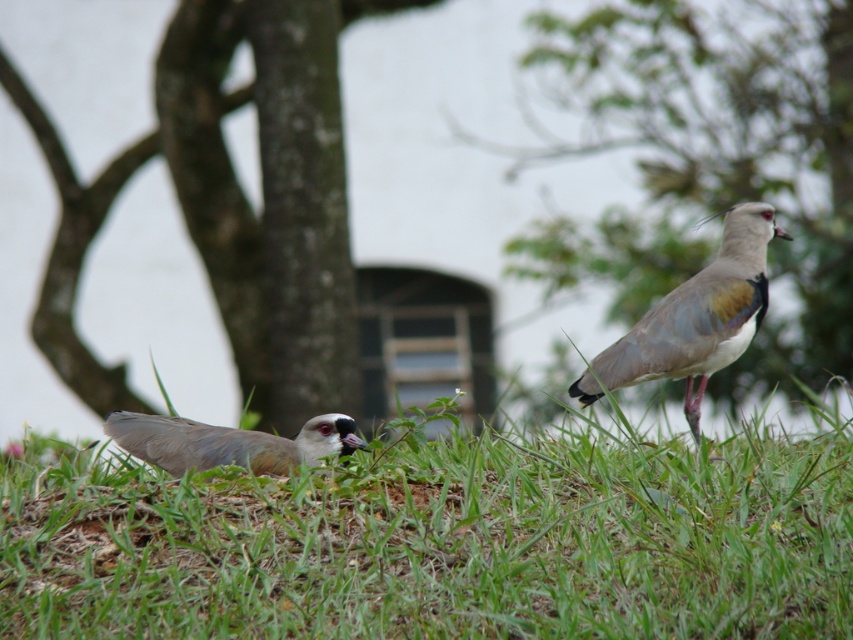
Question: Which point is closer to the camera taking this photo?

Choices:
 (A) (350, 422)
 (B) (643, 189)
 (C) (726, 520)

Answer: (C)

Question: Is green textured tree at center in front of green leafy tree at center?

Choices:
 (A) no
 (B) yes

Answer: (A)

Question: Based on their relative distances, which object is farther from the brown feathered bird at lower left?

Choices:
 (A) green leafy tree at center
 (B) green grass at lower left
 (C) green textured tree at center

Answer: (A)

Question: Is green grass at lower left to the left of brown feathered bird at right from the viewer's perspective?

Choices:
 (A) yes
 (B) no

Answer: (A)

Question: Does green textured tree at center appear on the left side of brown feathered bird at lower left?

Choices:
 (A) no
 (B) yes

Answer: (A)

Question: Which of the following is the farthest from the observer?

Choices:
 (A) [740, 241]
 (B) [206, 452]
 (C) [769, 49]
 (D) [627, 97]

Answer: (D)